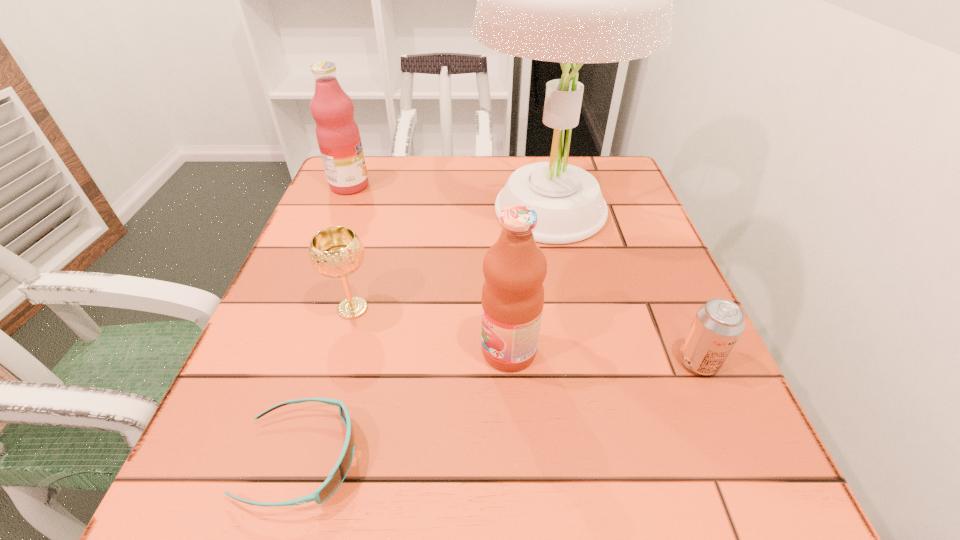
Identify the location of chalice that is at the left edge. (336, 252).

Locate an element on the screen. The height and width of the screenshot is (540, 960). sunglasses situated at the left edge is located at coordinates (337, 475).

Identify the location of lamp located in the right edge section of the desktop. The height and width of the screenshot is (540, 960). (571, 0).

Locate an element on the screen. The height and width of the screenshot is (540, 960). beer can that is at the right edge is located at coordinates (718, 324).

The image size is (960, 540). Find the location of `object that is at the far left corner`. object that is at the far left corner is located at coordinates click(337, 133).

Find the location of a particular element. object that is positioned at the near left corner is located at coordinates (337, 475).

Where is `object positioned at the far right corner`? The height and width of the screenshot is (540, 960). object positioned at the far right corner is located at coordinates (571, 0).

In the image, there is a desktop. Where is `vacant space at the far edge`? The height and width of the screenshot is (540, 960). vacant space at the far edge is located at coordinates pos(410,167).

Find the location of a particular element. The width and height of the screenshot is (960, 540). free space at the near edge is located at coordinates (573, 521).

Identify the location of free space at the left edge of the desktop. The width and height of the screenshot is (960, 540). point(312,448).